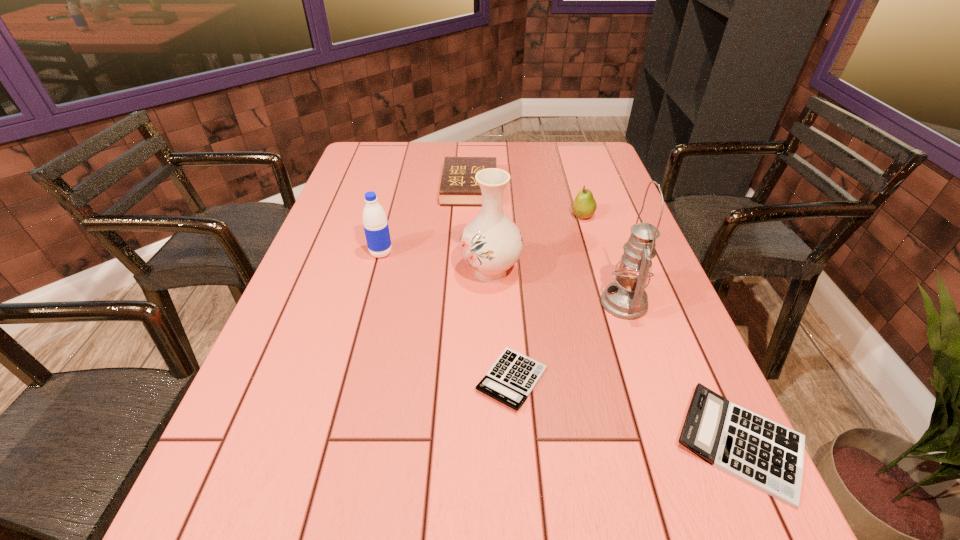
At what (x,y) coordinates should I click in order to perform the action: click on object that is the fourth closest to the sixth tallest object. Please return your answer as a coordinate pair (x, y). Image resolution: width=960 pixels, height=540 pixels. Looking at the image, I should click on (584, 205).

Locate an element on the screen. object that stands as the second closest to the left calculator is located at coordinates (491, 243).

The width and height of the screenshot is (960, 540). What are the coordinates of `free point that satisfies the following two spatial constraints: 1. on the front side of the fourth tallest object; 2. on the left side of the second shortest object` in the screenshot? It's located at (652, 443).

The height and width of the screenshot is (540, 960). In order to click on free location that satisfies the following two spatial constraints: 1. on the front side of the right calculator; 2. on the left side of the sixth shortest object in this screenshot , I will do `click(495, 443)`.

Locate an element on the screen. The image size is (960, 540). vacant space that satisfies the following two spatial constraints: 1. on the front side of the second tallest object; 2. on the right side of the fifth shortest object is located at coordinates (376, 272).